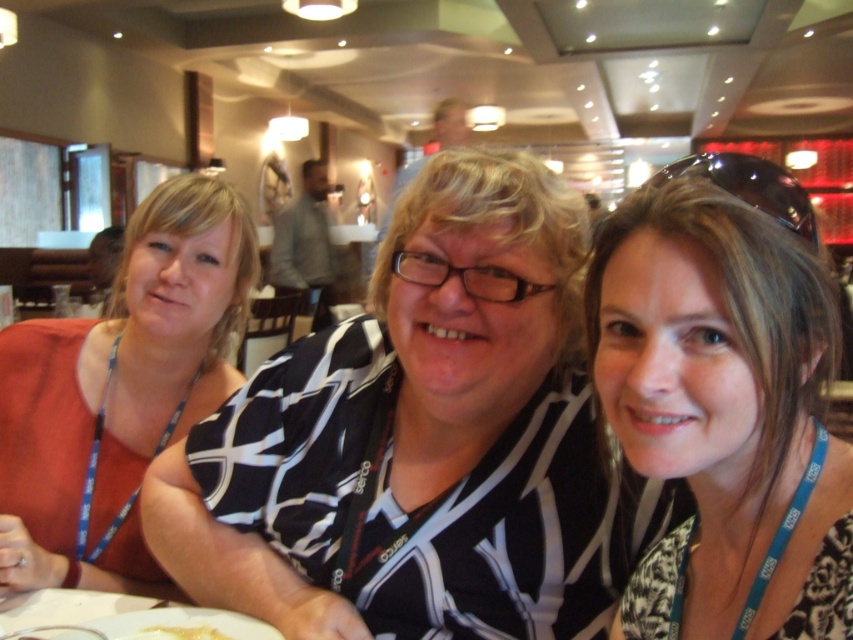
You are a photographer adjusting the camera focus. The camera is currently focused on the point at coordinates (422,442). Which person in the scene is the camera focused on?

The camera is focused on the black and white striped shirt at center, which is the central figure wearing glasses and a black and white patterned top.

From the picture: You are a photographer setting up for a group photo. You notice the matte black shirt at center and the white creamy food at lower left. Based on their positions, which object is closer to the left side of the image?

The white creamy food at lower left is closer to the left side of the image because the matte black shirt at center is to its right.